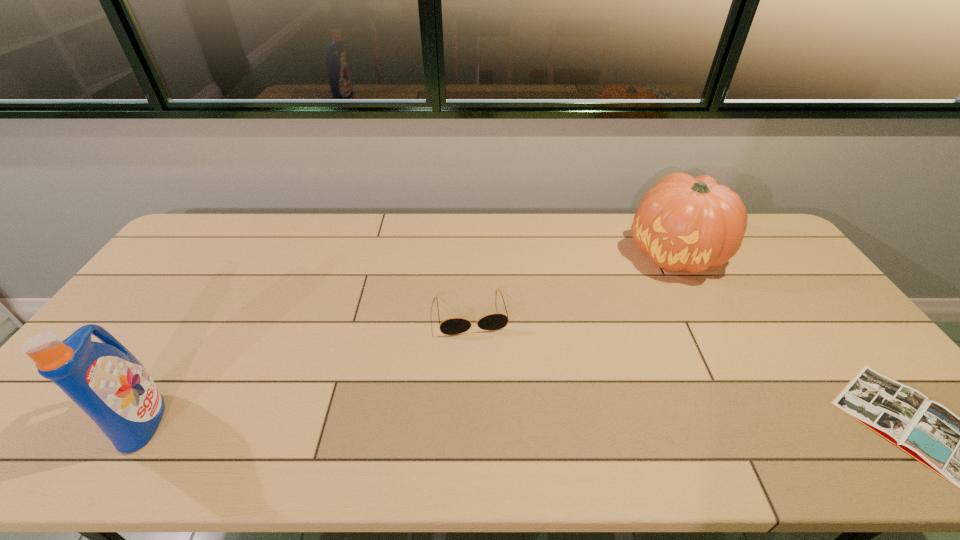
In order to click on vacant space on the desktop that is between the leftmost object and the rightmost object and is positioned on the front-facing side of the third nearest object in this screenshot , I will do pos(491,421).

This screenshot has width=960, height=540. What are the coordinates of `free space on the desktop that is between the detergent and the book and is positioned on the carved face of the second object from right to left` in the screenshot? It's located at (581, 421).